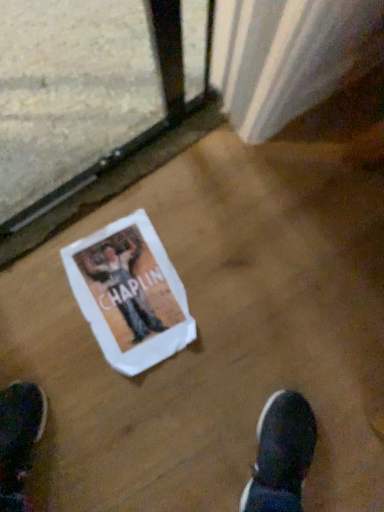
What are the coordinates of `spots to the right of white paper flyer at center` in the screenshot? It's located at (239, 290).